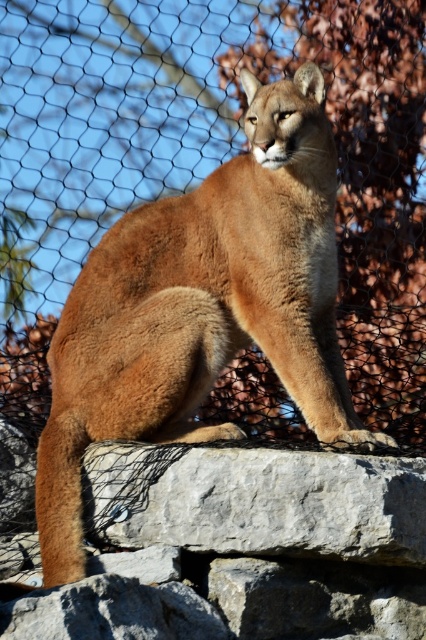
Question: Which of the following is the closest to the observer?

Choices:
 (A) (317, 348)
 (B) (158, 630)
 (C) (173, 456)

Answer: (B)

Question: Which object appears farthest from the camera in this image?

Choices:
 (A) gray stone boulder at center
 (B) gray rough rock at lower center
 (C) golden fur cougar at center

Answer: (C)

Question: Among these objects, which one is farthest from the camera?

Choices:
 (A) golden fur cougar at center
 (B) gray stone boulder at center

Answer: (A)

Question: Is gray stone boulder at center to the right of gray rough rock at lower center from the viewer's perspective?

Choices:
 (A) yes
 (B) no

Answer: (A)

Question: Is golden fur cougar at center positioned at the back of gray rough rock at lower center?

Choices:
 (A) no
 (B) yes

Answer: (B)

Question: In this image, where is gray stone boulder at center located relative to gray rough rock at lower center?

Choices:
 (A) above
 (B) below

Answer: (A)